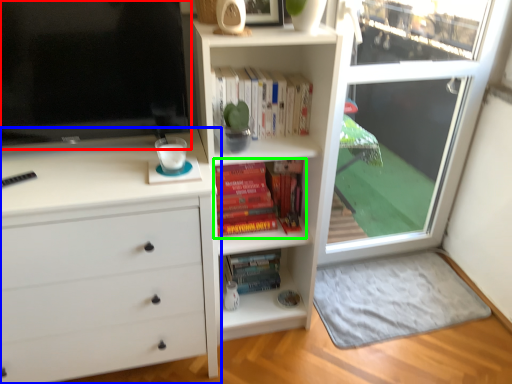
Question: Which object is positioned closest to television (highlighted by a red box)? Select from chest of drawers (highlighted by a blue box) and book (highlighted by a green box).

Choices:
 (A) chest of drawers
 (B) book

Answer: (A)